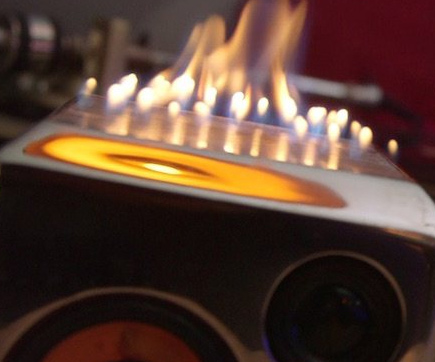
Locate an element on the screen. 1 grey section of table is located at coordinates (397, 209).